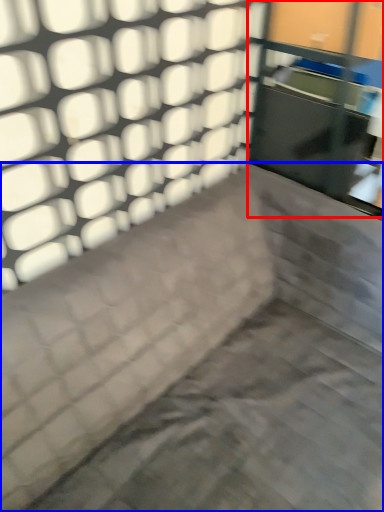
Question: Which object is further to the camera taking this photo, glass door (highlighted by a red box) or furniture (highlighted by a blue box)?

Choices:
 (A) glass door
 (B) furniture

Answer: (A)